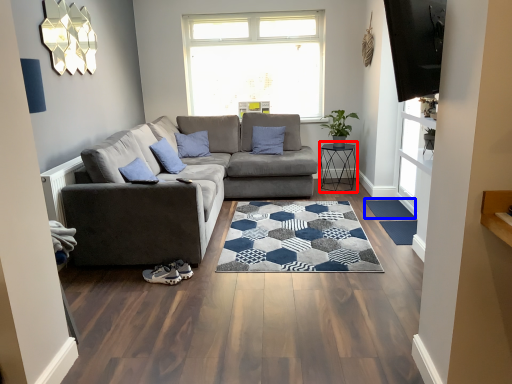
Question: Which of the following is the closest to the observer, table (highlighted by a red box) or flat (highlighted by a blue box)?

Choices:
 (A) table
 (B) flat

Answer: (B)